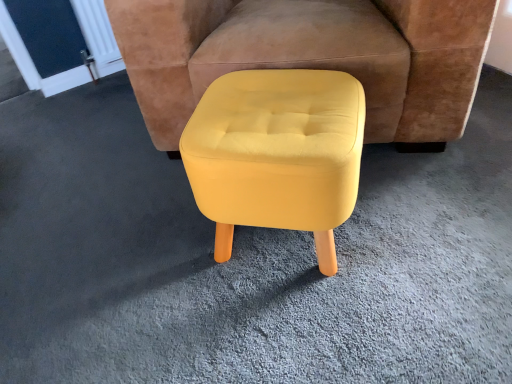
Locate an element on the screen. Image resolution: width=512 pixels, height=384 pixels. free space above yellow fabric stool at center (from a real-world perspective) is located at coordinates (271, 113).